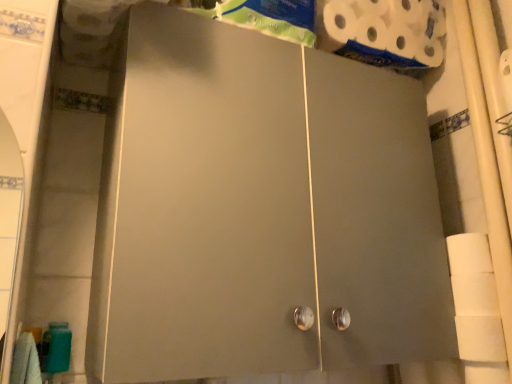
Question: Can you confirm if white matte toilet paper at right, positioned as the 1th toilet paper in bottom-to-top order, is wider than white matte toilet paper at upper right, which appears as the second toilet paper when viewed from the front?

Choices:
 (A) no
 (B) yes

Answer: (A)

Question: Could you tell me if white matte toilet paper at right, arranged as the second toilet paper when viewed from the top, is facing white matte toilet paper at upper right, acting as the first toilet paper starting from the back?

Choices:
 (A) no
 (B) yes

Answer: (A)

Question: Is white matte toilet paper at right, acting as the first toilet paper starting from the front, at the left side of white matte toilet paper at upper right, the 1th toilet paper positioned from the top?

Choices:
 (A) no
 (B) yes

Answer: (A)

Question: From the image's perspective, does white matte toilet paper at right, acting as the first toilet paper starting from the front, appear higher than white matte toilet paper at upper right, marked as the second toilet paper in a bottom-to-top arrangement?

Choices:
 (A) no
 (B) yes

Answer: (A)

Question: Is white matte toilet paper at right, arranged as the second toilet paper when viewed from the top, outside of white matte toilet paper at upper right, acting as the first toilet paper starting from the back?

Choices:
 (A) yes
 (B) no

Answer: (A)

Question: Considering the relative positions of white matte toilet paper at right, arranged as the second toilet paper when viewed from the top, and white matte toilet paper at upper right, marked as the second toilet paper in a bottom-to-top arrangement, in the image provided, is white matte toilet paper at right, arranged as the second toilet paper when viewed from the top, to the right of white matte toilet paper at upper right, marked as the second toilet paper in a bottom-to-top arrangement, from the viewer's perspective?

Choices:
 (A) no
 (B) yes

Answer: (B)

Question: From a real-world perspective, is matte gray cabinet at center beneath white matte toilet paper at right, positioned as the 1th toilet paper in bottom-to-top order?

Choices:
 (A) yes
 (B) no

Answer: (B)

Question: Is matte gray cabinet at center thinner than white matte toilet paper at right, acting as the first toilet paper starting from the front?

Choices:
 (A) no
 (B) yes

Answer: (A)

Question: Can you confirm if matte gray cabinet at center is shorter than white matte toilet paper at right, arranged as the second toilet paper when viewed from the top?

Choices:
 (A) no
 (B) yes

Answer: (A)

Question: Does matte gray cabinet at center have a larger size compared to white matte toilet paper at right, positioned as the 1th toilet paper in bottom-to-top order?

Choices:
 (A) no
 (B) yes

Answer: (B)

Question: From a real-world perspective, is matte gray cabinet at center on white matte toilet paper at right, arranged as the second toilet paper when viewed from the top?

Choices:
 (A) yes
 (B) no

Answer: (A)

Question: Does matte gray cabinet at center appear on the right side of white matte toilet paper at right, positioned as the 1th toilet paper in bottom-to-top order?

Choices:
 (A) no
 (B) yes

Answer: (A)

Question: Considering the relative positions of white matte toilet paper at right, positioned as the 1th toilet paper in bottom-to-top order, and matte gray cabinet at center in the image provided, is white matte toilet paper at right, positioned as the 1th toilet paper in bottom-to-top order, to the right of matte gray cabinet at center from the viewer's perspective?

Choices:
 (A) no
 (B) yes

Answer: (B)